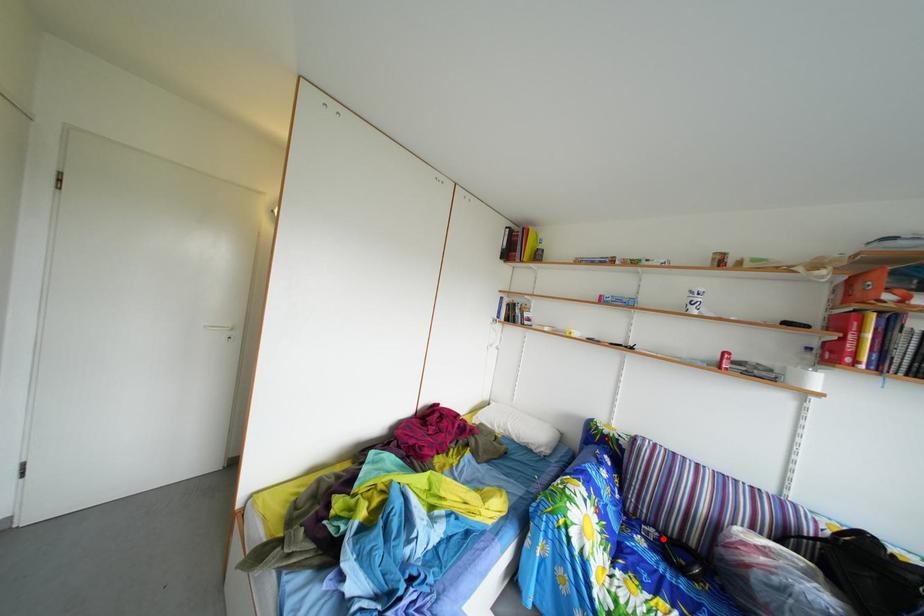
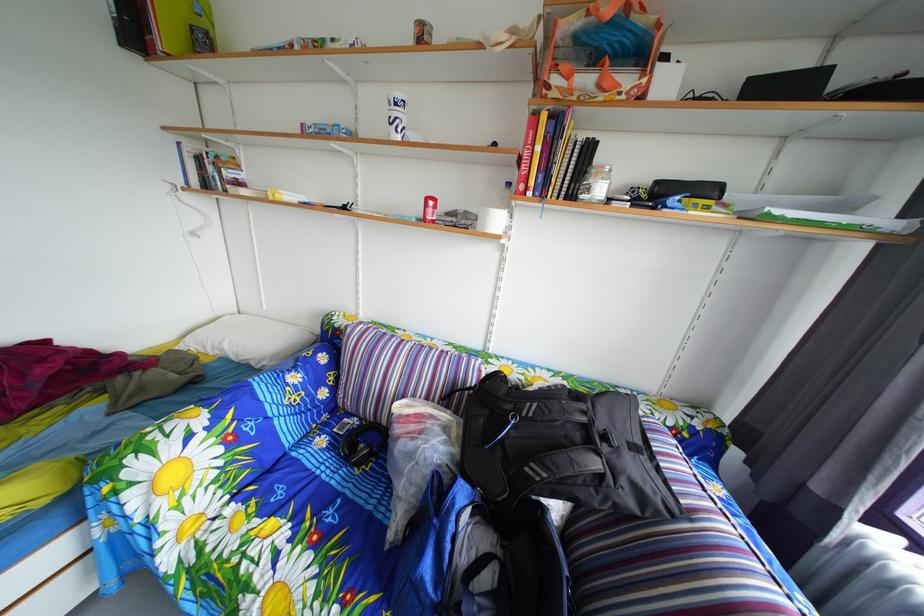
Question: I am providing you with two images of the same scene from different viewpoints. A red point is shown in image1. For the corresponding object point in image2, is it positioned nearer or farther from the camera?

Choices:
 (A) Nearer
 (B) Farther

Answer: (B)